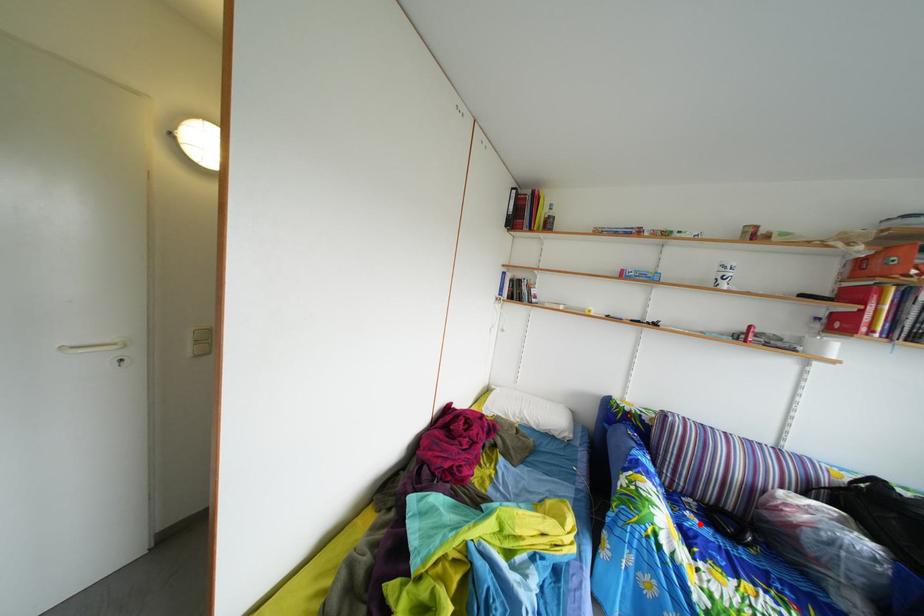
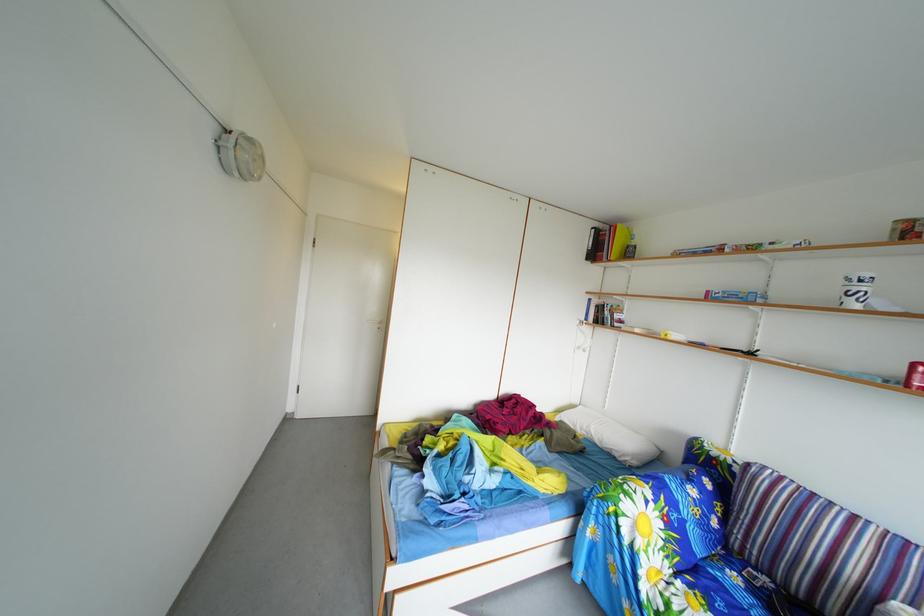
Find the pixel in the second image that matches the highlighted location in the first image.

(746, 585)